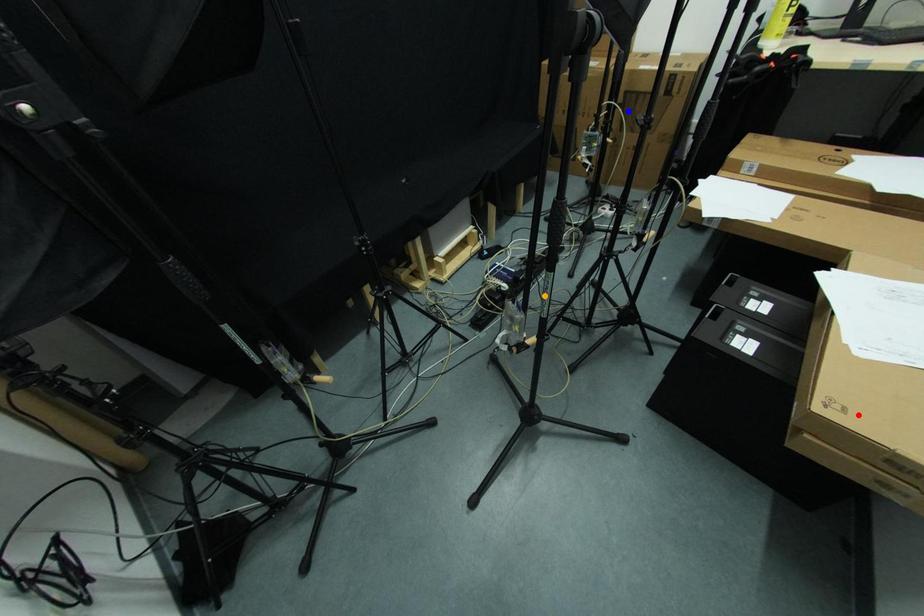
Consider the image. Order these from nearest to farthest:
orange point, blue point, red point

red point < orange point < blue point